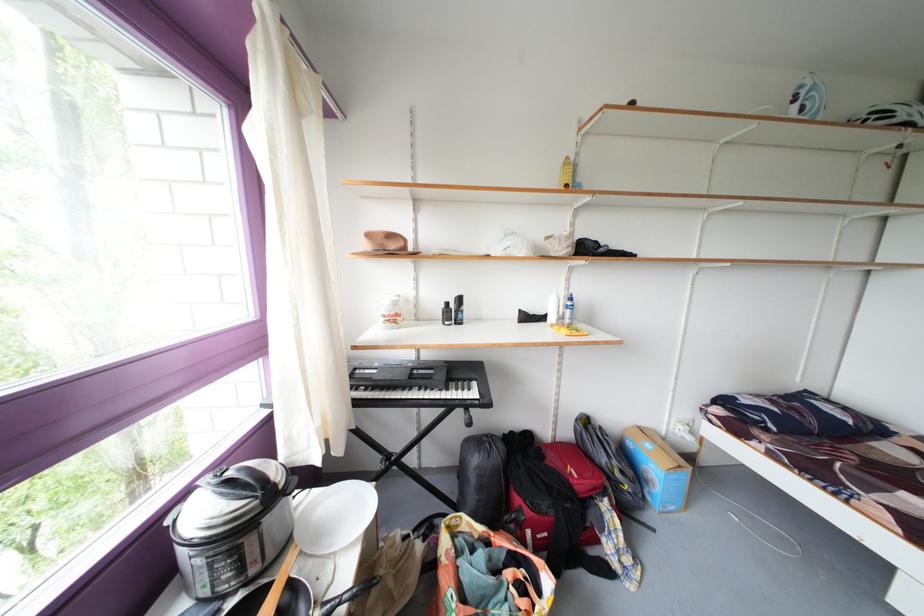
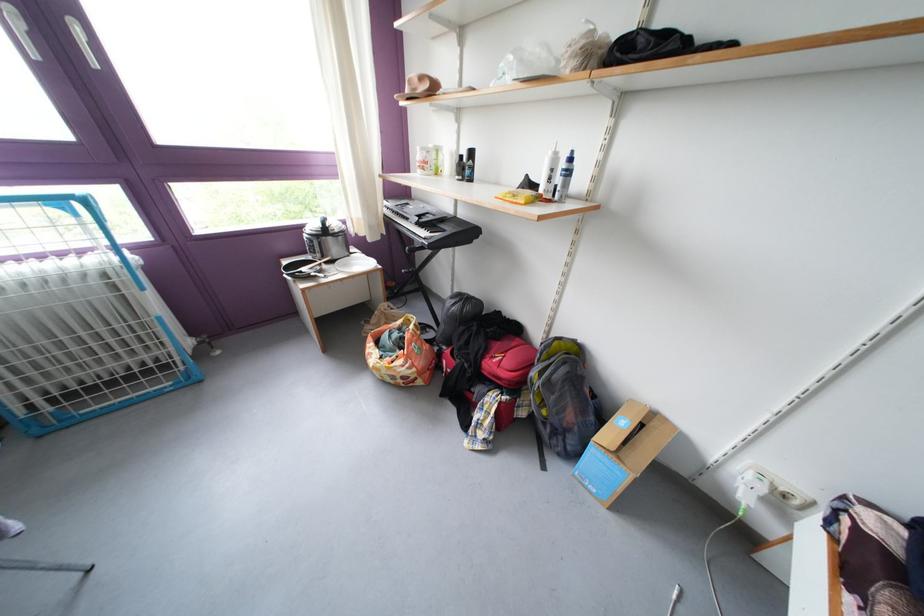
In the second image, find the point that corresponds to the point at 684,426 in the first image.

(758, 467)